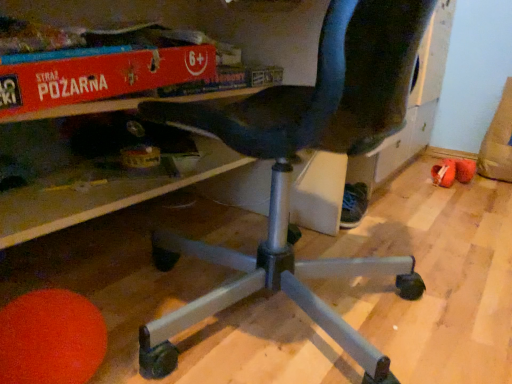
Where is `vacant area that lies in front of orange fabric shoe at lower right, marked as the second footwear in a front-to-back arrangement`? The height and width of the screenshot is (384, 512). vacant area that lies in front of orange fabric shoe at lower right, marked as the second footwear in a front-to-back arrangement is located at coordinates point(457,200).